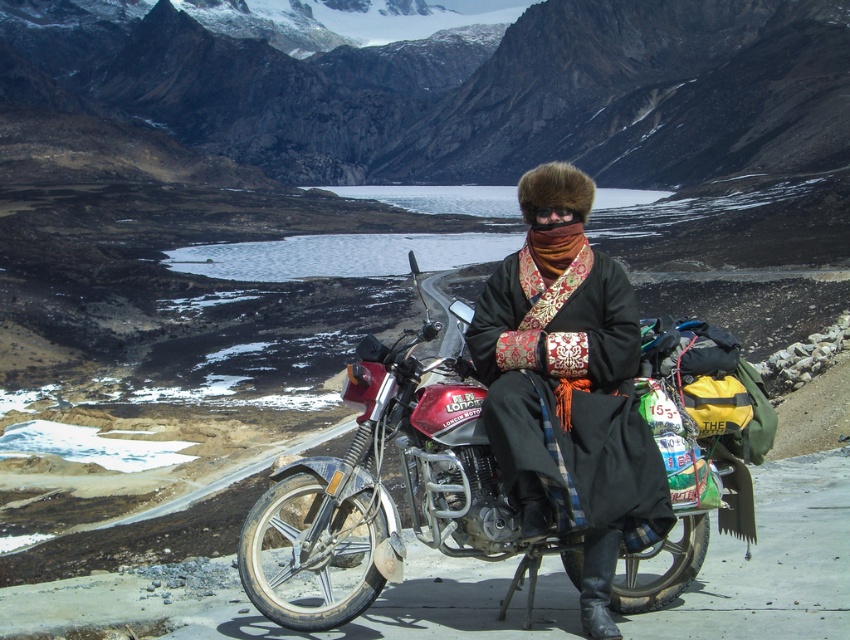
Question: Is metallic red motorcycle at center further to camera compared to black fur hat at center?

Choices:
 (A) yes
 (B) no

Answer: (B)

Question: Observing the image, what is the correct spatial positioning of metallic red motorcycle at center in reference to black fur hat at center?

Choices:
 (A) right
 (B) left

Answer: (B)

Question: Which of the following is the closest to the observer?

Choices:
 (A) (613, 541)
 (B) (401, 344)

Answer: (A)

Question: Is metallic red motorcycle at center above black fur hat at center?

Choices:
 (A) no
 (B) yes

Answer: (A)